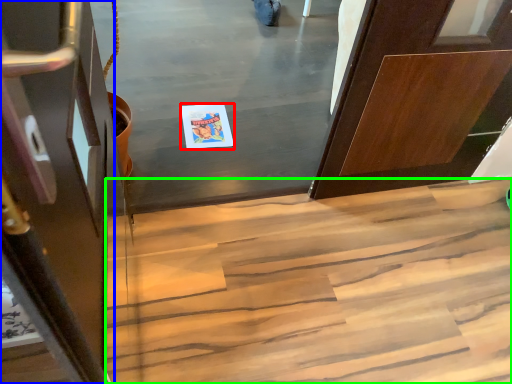
Question: Which object is the farthest from postcard (highlighted by a red box)? Choose among these: door (highlighted by a blue box) or stairs (highlighted by a green box).

Choices:
 (A) door
 (B) stairs

Answer: (A)